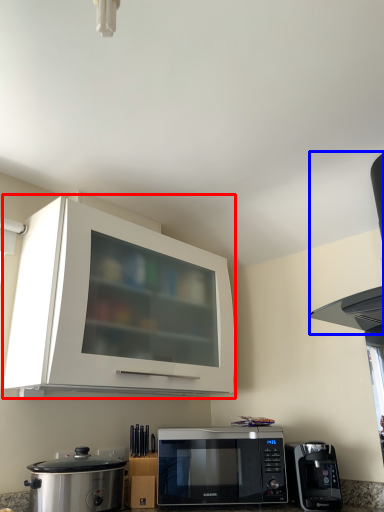
Question: Which point is closer to the camera, cabinetry (highlighted by a red box) or vent (highlighted by a blue box)?

Choices:
 (A) cabinetry
 (B) vent

Answer: (B)